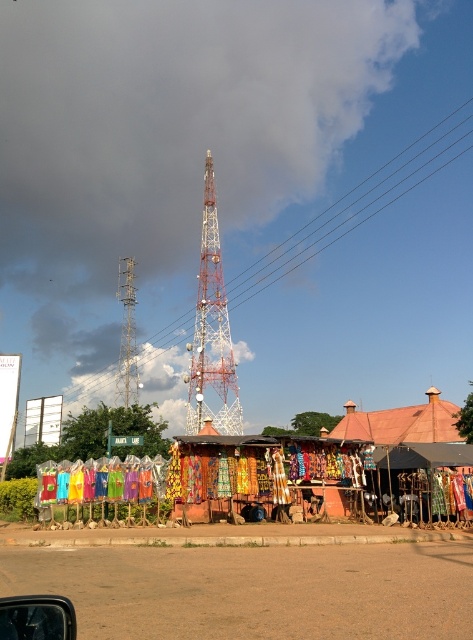
Does metallic red tower at center appear under terracotta clay hut at lower right?

Incorrect, metallic red tower at center is not positioned below terracotta clay hut at lower right.

Does metallic red tower at center appear over terracotta clay hut at lower right?

Yes.

Is point (203, 352) positioned after point (460, 492)?

Yes.

This screenshot has width=473, height=640. What are the coordinates of `metallic red tower at center` in the screenshot? It's located at (211, 332).

This screenshot has height=640, width=473. Describe the element at coordinates (410, 435) in the screenshot. I see `terracotta clay hut at lower right` at that location.

From the picture: Measure the distance between terracotta clay hut at lower right and metallic silver tower at left.

terracotta clay hut at lower right and metallic silver tower at left are 104.72 meters apart.

Between point (423, 420) and point (131, 362), which one is positioned behind?

Point (131, 362)

Locate an element on the screen. This screenshot has width=473, height=640. terracotta clay hut at lower right is located at coordinates (410, 435).

Who is taller, terracotta clay hut at lower right or transparent glass car window at lower left?

terracotta clay hut at lower right

Where is `terracotta clay hut at lower right`? The width and height of the screenshot is (473, 640). terracotta clay hut at lower right is located at coordinates (410, 435).

Image resolution: width=473 pixels, height=640 pixels. In order to click on terracotta clay hut at lower right in this screenshot , I will do `click(410, 435)`.